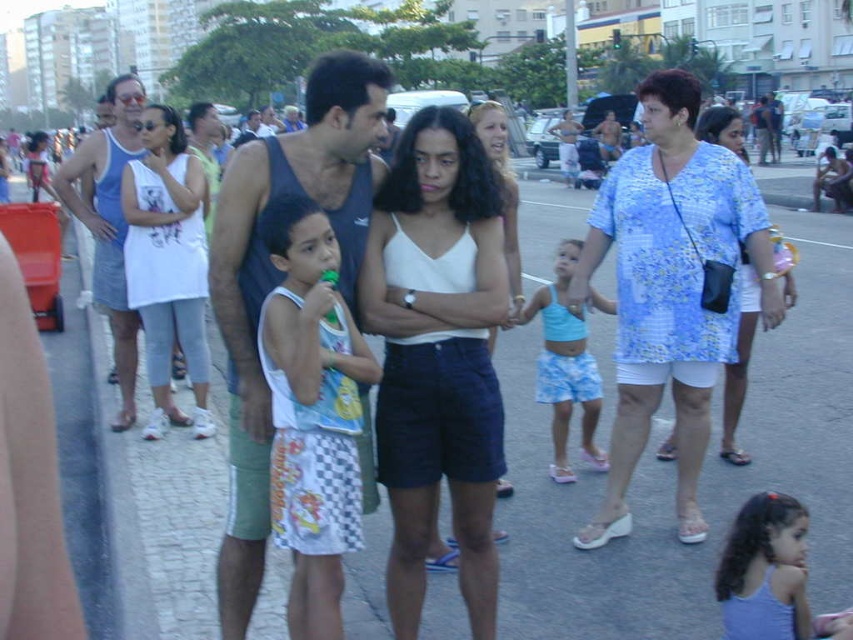
Between light blue fabric shorts at center and white matte tank top at center, which one appears on the right side from the viewer's perspective?

Positioned to the right is white matte tank top at center.

Measure the distance between point [605,308] and camera.

Point [605,308] is 4.97 meters away from camera.

Describe the element at coordinates (566, 365) in the screenshot. The image size is (853, 640). I see `light blue fabric shorts at center` at that location.

Where is `light blue fabric shorts at center`? light blue fabric shorts at center is located at coordinates (566, 365).

Can you confirm if matte blue tank top at center is positioned to the right of light purple fabric dress at lower right?

Incorrect, matte blue tank top at center is not on the right side of light purple fabric dress at lower right.

Which is behind, point (334, 113) or point (779, 579)?

Point (334, 113)

The image size is (853, 640). I want to click on matte blue tank top at center, so click(x=279, y=280).

Between point (401, 179) and point (758, 524), which one is positioned in front?

Point (758, 524)

Who is lower down, white cotton tank top at center or light purple fabric dress at lower right?

light purple fabric dress at lower right is lower down.

Which is behind, point (421, 545) or point (743, 540)?

The point (421, 545) is behind.

The height and width of the screenshot is (640, 853). I want to click on white cotton tank top at center, so click(437, 356).